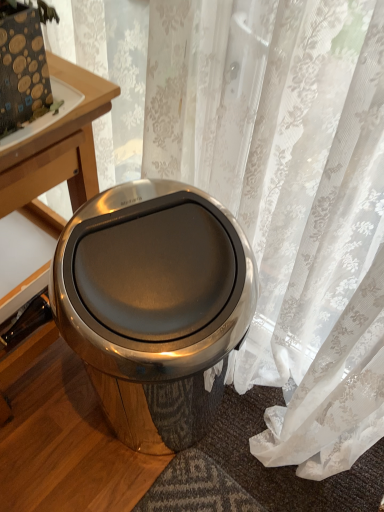
Image resolution: width=384 pixels, height=512 pixels. Find the location of `vacant space to the right of polished stainless steel trash can at center`. vacant space to the right of polished stainless steel trash can at center is located at coordinates (252, 452).